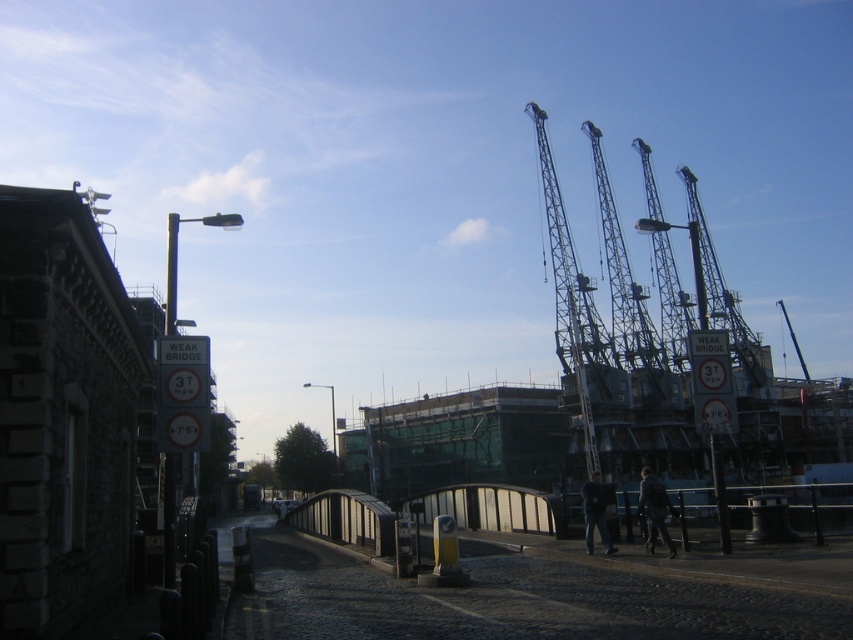
Is metallic gray crane at center positioned behind metallic gray crane at upper right?

That is False.

Does metallic gray crane at center have a greater height compared to metallic gray crane at upper right?

Yes, metallic gray crane at center is taller than metallic gray crane at upper right.

Identify the location of metallic gray crane at center. (572, 300).